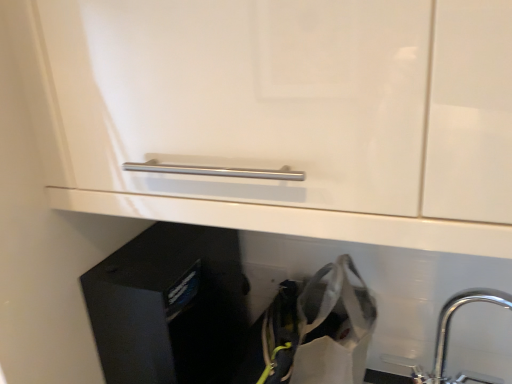
Where is `black matte file cabinet at lower left`? The width and height of the screenshot is (512, 384). black matte file cabinet at lower left is located at coordinates (169, 306).

Which object is positioned more to the left, black matte file cabinet at lower left or chrome metallic tap at lower right?

black matte file cabinet at lower left is more to the left.

Is black matte file cabinet at lower left positioned before chrome metallic tap at lower right?

No, the depth of black matte file cabinet at lower left is greater than that of chrome metallic tap at lower right.

Is black matte file cabinet at lower left with chrome metallic tap at lower right?

No, black matte file cabinet at lower left is not next to chrome metallic tap at lower right.

Which is in front, white fabric shopping bag at lower right or black matte file cabinet at lower left?

white fabric shopping bag at lower right is closer to the camera.

Is white fabric shopping bag at lower right oriented away from black matte file cabinet at lower left?

No, white fabric shopping bag at lower right's orientation is not away from black matte file cabinet at lower left.

Does white fabric shopping bag at lower right contain black matte file cabinet at lower left?

No, black matte file cabinet at lower left is not a part of white fabric shopping bag at lower right.

Considering the sizes of white fabric shopping bag at lower right and black matte file cabinet at lower left in the image, is white fabric shopping bag at lower right wider or thinner than black matte file cabinet at lower left?

white fabric shopping bag at lower right is thinner than black matte file cabinet at lower left.

At what (x,y) coordinates should I click in order to perform the action: click on tap to the right of white fabric shopping bag at lower right. Please return your answer as a coordinate pair (x, y). The image size is (512, 384). Looking at the image, I should click on (448, 337).

Considering the relative sizes of chrome metallic tap at lower right and white fabric shopping bag at lower right in the image provided, is chrome metallic tap at lower right smaller than white fabric shopping bag at lower right?

Yes.

Is white fabric shopping bag at lower right at the back of chrome metallic tap at lower right?

No.

The height and width of the screenshot is (384, 512). What are the coordinates of `file cabinet directly beneath the chrome metallic tap at lower right (from a real-world perspective)` in the screenshot? It's located at (169, 306).

Considering the relative sizes of chrome metallic tap at lower right and black matte file cabinet at lower left in the image provided, is chrome metallic tap at lower right smaller than black matte file cabinet at lower left?

Yes.

Based on the photo, from a real-world perspective, which object stands above the other?

In real-world perspective, chrome metallic tap at lower right is above.

Is chrome metallic tap at lower right aimed at black matte file cabinet at lower left?

No, chrome metallic tap at lower right does not turn towards black matte file cabinet at lower left.

Which of these two, white fabric shopping bag at lower right or chrome metallic tap at lower right, is bigger?

Bigger between the two is white fabric shopping bag at lower right.

Is the surface of white fabric shopping bag at lower right in direct contact with chrome metallic tap at lower right?

No, white fabric shopping bag at lower right is not making contact with chrome metallic tap at lower right.

Would you say white fabric shopping bag at lower right is to the left or to the right of chrome metallic tap at lower right in the picture?

Clearly, white fabric shopping bag at lower right is on the left of chrome metallic tap at lower right in the image.

From the image's perspective, which object appears higher, white fabric shopping bag at lower right or chrome metallic tap at lower right?

chrome metallic tap at lower right appears higher in the image.

Considering the positions of points (206, 340) and (357, 286), is point (206, 340) farther from camera compared to point (357, 286)?

Yes, point (206, 340) is farther from viewer.

Where is `file cabinet that appears above the white fabric shopping bag at lower right (from a real-world perspective)`? file cabinet that appears above the white fabric shopping bag at lower right (from a real-world perspective) is located at coordinates (169, 306).

I want to click on tap that is above the black matte file cabinet at lower left (from a real-world perspective), so click(448, 337).

Find the location of a particular element. file cabinet behind the white fabric shopping bag at lower right is located at coordinates (169, 306).

When comparing their distances from chrome metallic tap at lower right, does white fabric shopping bag at lower right or black matte file cabinet at lower left seem closer?

white fabric shopping bag at lower right is positioned closer to the anchor chrome metallic tap at lower right.

Based on their spatial positions, is black matte file cabinet at lower left or white fabric shopping bag at lower right further from chrome metallic tap at lower right?

The object further to chrome metallic tap at lower right is black matte file cabinet at lower left.

Considering their positions, is chrome metallic tap at lower right positioned closer to white fabric shopping bag at lower right than black matte file cabinet at lower left?

Based on the image, chrome metallic tap at lower right appears to be nearer to white fabric shopping bag at lower right.

Considering their positions, is chrome metallic tap at lower right positioned closer to black matte file cabinet at lower left than white fabric shopping bag at lower right?

white fabric shopping bag at lower right is positioned closer to the anchor black matte file cabinet at lower left.

Considering their positions, is white fabric shopping bag at lower right positioned further to black matte file cabinet at lower left than chrome metallic tap at lower right?

The object further to black matte file cabinet at lower left is chrome metallic tap at lower right.

From the image, which object appears to be farther from white fabric shopping bag at lower right, black matte file cabinet at lower left or chrome metallic tap at lower right?

black matte file cabinet at lower left is positioned further to the anchor white fabric shopping bag at lower right.

Locate an element on the screen. shopping bag between black matte file cabinet at lower left and chrome metallic tap at lower right from left to right is located at coordinates (334, 326).